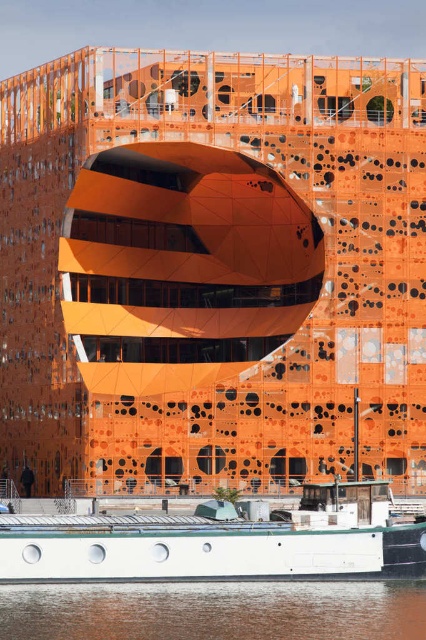
Question: Considering the real-world distances, which object is closest to the brown water at lower center?

Choices:
 (A) white matte boat at lower center
 (B) orange matte building at center

Answer: (A)

Question: Which is farther from the orange matte building at center?

Choices:
 (A) white matte boat at lower center
 (B) brown water at lower center

Answer: (B)

Question: Is orange matte building at center positioned in front of white matte boat at lower center?

Choices:
 (A) no
 (B) yes

Answer: (A)

Question: Is orange matte building at center to the right of brown water at lower center from the viewer's perspective?

Choices:
 (A) no
 (B) yes

Answer: (A)

Question: Observing the image, what is the correct spatial positioning of orange matte building at center in reference to brown water at lower center?

Choices:
 (A) right
 (B) left

Answer: (B)

Question: Which point is closer to the camera?

Choices:
 (A) (324, 636)
 (B) (362, 506)

Answer: (A)